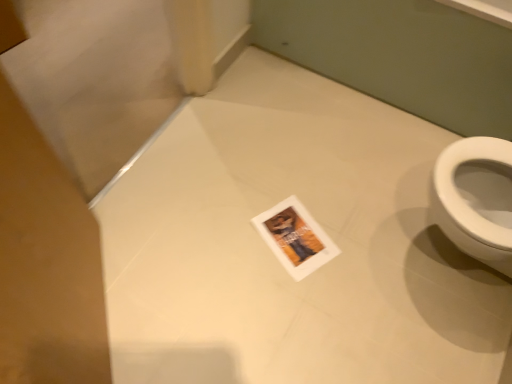
Where is `vacant space behind white paper postcard at center`? The image size is (512, 384). vacant space behind white paper postcard at center is located at coordinates (288, 182).